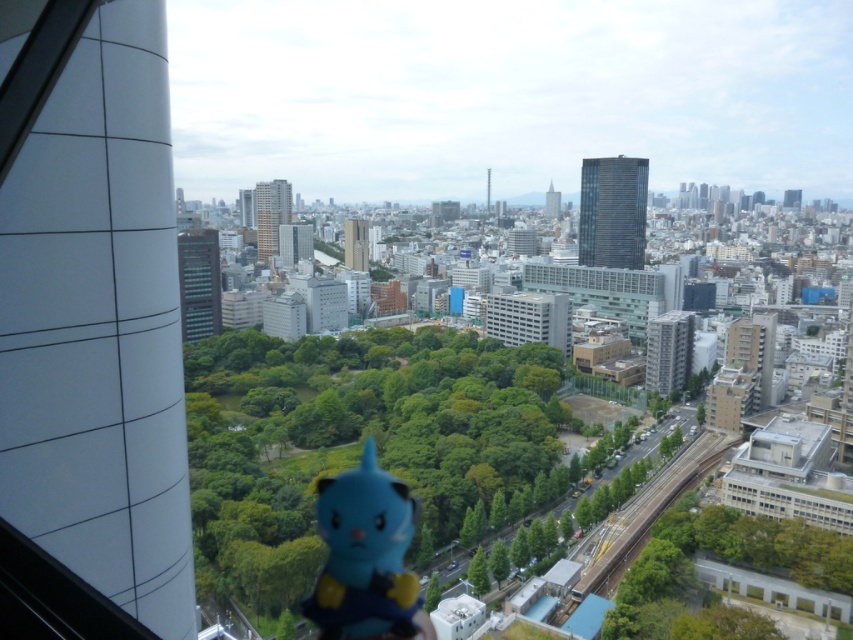
You are a city planner analyzing the view from this building. You need to determine if the green leafy trees at center are wider than the blue rubber toy at center. Based on the scene, what can you conclude?

The green leafy trees at center are wider than the blue rubber toy at center because the description states that the green leafy trees at center surpass the blue rubber toy at center in width.

From the picture: You are standing in a room with a large window. You see the green leafy trees at center and the transparent glass window at lower right. Which object is closer to the left side of the room?

The green leafy trees at center is closer to the left side of the room because it is positioned to the left of the transparent glass window at lower right.

You are standing in a room with a large window. You see two points marked on the window glass. The first point is at coordinate point(270, 586) and the second is at point(654, 630). Which point is closer to you?

Point(270, 586) is closer to you because it is further to the viewer than point(654, 630).